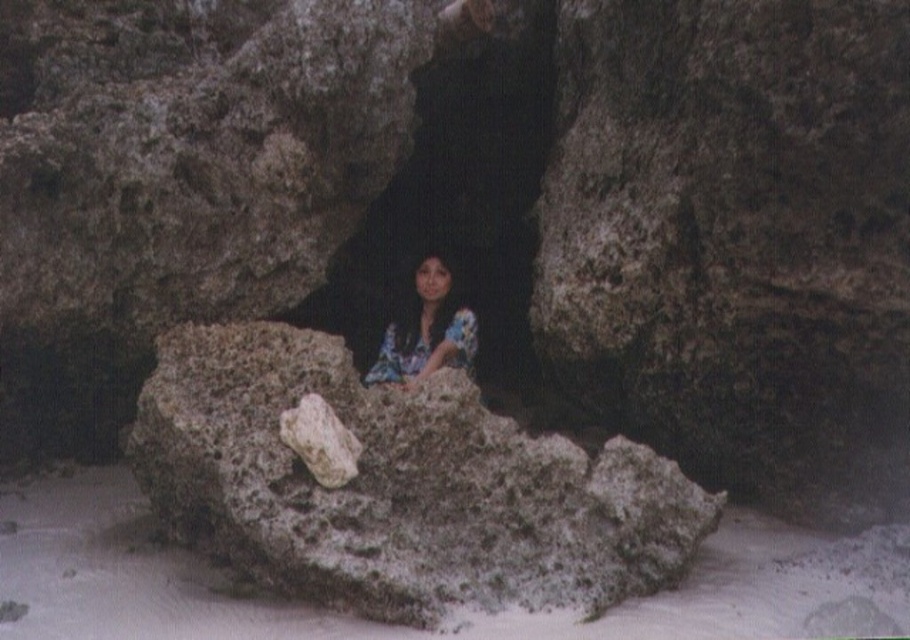
Can you confirm if rough textured rock at center is bigger than floral fabric woman at center?

Yes, rough textured rock at center is bigger than floral fabric woman at center.

How far apart are rough textured rock at center and floral fabric woman at center?

rough textured rock at center is 1.06 meters from floral fabric woman at center.

In the scene shown: Who is more distant from viewer, [375,516] or [422,339]?

Positioned behind is point [422,339].

At what (x,y) coordinates should I click in order to perform the action: click on rough textured rock at center. Please return your answer as a coordinate pair (x, y). Looking at the image, I should click on (399, 486).

Is point (640, 532) closer to viewer compared to point (138, 540)?

Yes, point (640, 532) is closer to viewer.

Who is shorter, rough textured rock at center or white sand at center?

With less height is white sand at center.

Between point (238, 332) and point (100, 579), which one is positioned in front?

Point (100, 579) is more forward.

Where is `rough textured rock at center`? The height and width of the screenshot is (640, 910). rough textured rock at center is located at coordinates (399, 486).

Between point (834, 554) and point (467, 317), which one is positioned behind?

The point (467, 317) is more distant.

Does point (120, 636) lie behind point (438, 317)?

No, it is in front of (438, 317).

Between point (784, 538) and point (401, 296), which one is positioned behind?

Point (401, 296)

The width and height of the screenshot is (910, 640). I want to click on white sand at center, so click(379, 625).